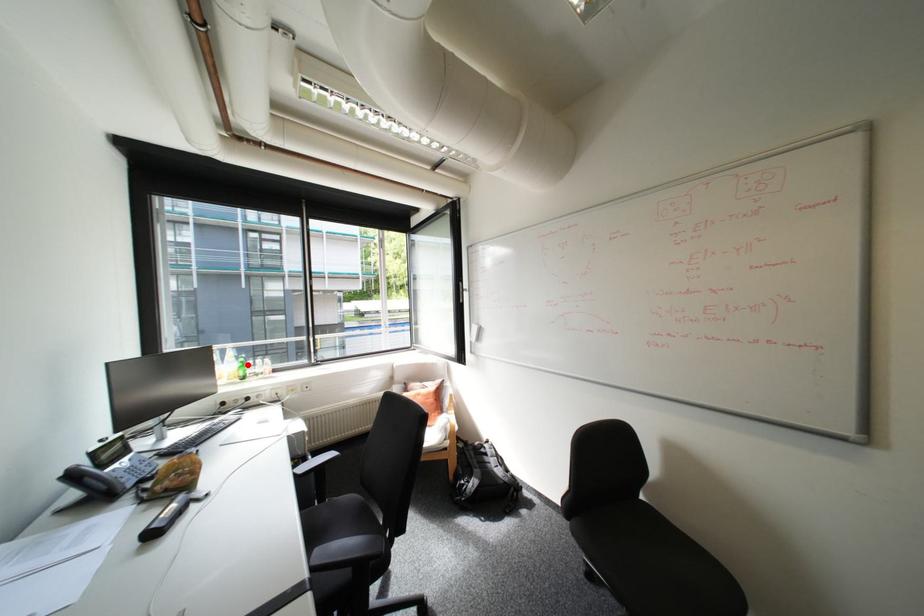
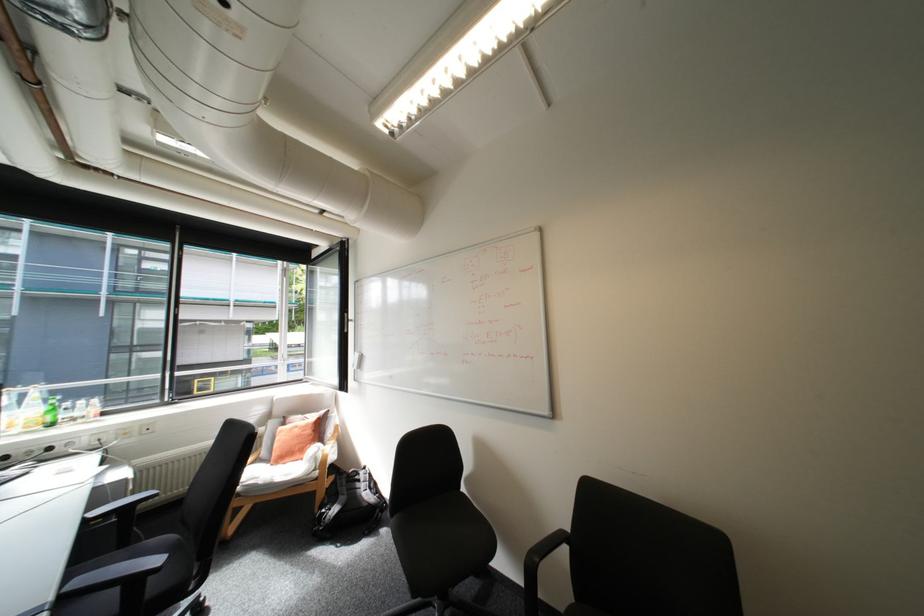
Question: I am providing you with two images of the same scene from different viewpoints. Given a red point in image1, look at the same physical point in image2. Is it:

Choices:
 (A) Closer to the viewpoint
 (B) Farther from the viewpoint

Answer: (A)